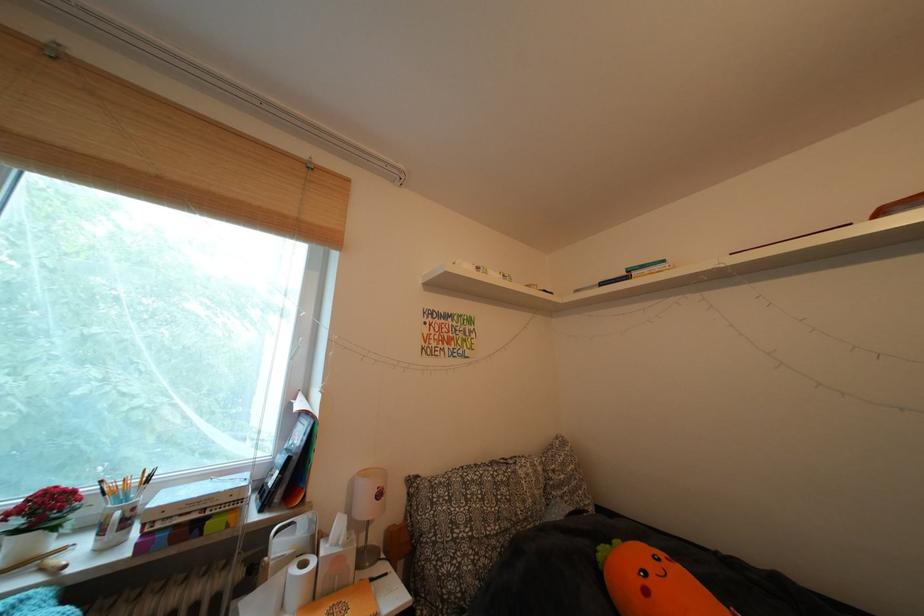
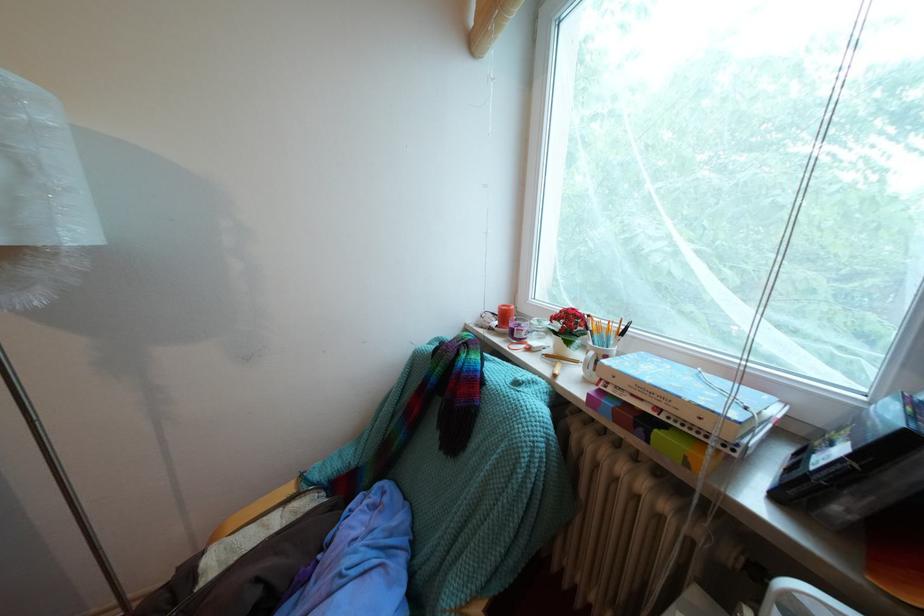
Locate, in the second image, the point that corresponds to (128,519) in the first image.

(602, 359)